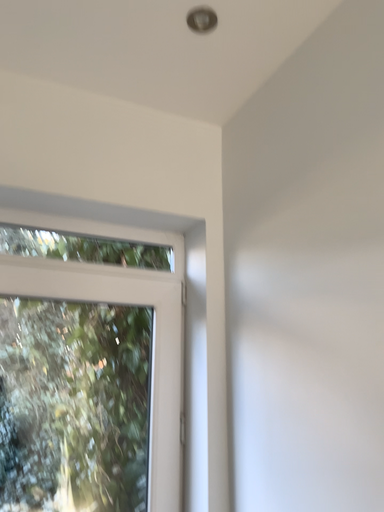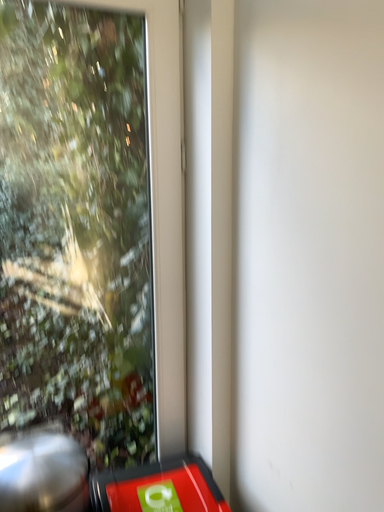
Question: Which way did the camera rotate in the video?

Choices:
 (A) rotated downward
 (B) rotated upward

Answer: (A)